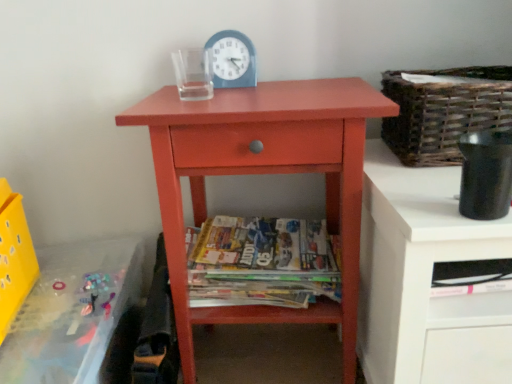
Question: In terms of width, does translucent plastic changing table at lower left look wider or thinner when compared to blue plastic clock at upper center?

Choices:
 (A) wide
 (B) thin

Answer: (A)

Question: In terms of size, does translucent plastic changing table at lower left appear bigger or smaller than blue plastic clock at upper center?

Choices:
 (A) small
 (B) big

Answer: (B)

Question: Which of these objects is positioned farthest from the matte wood nightstand at center?

Choices:
 (A) yellow plastic crate at lower left
 (B) printed paper magazines at center
 (C) woven brown basket at upper right
 (D) translucent plastic changing table at lower left
 (E) blue plastic clock at upper center

Answer: (A)

Question: Which is farther from the woven brown basket at upper right?

Choices:
 (A) blue plastic clock at upper center
 (B) yellow plastic crate at lower left
 (C) translucent plastic changing table at lower left
 (D) matte wood nightstand at center
 (E) printed paper magazines at center

Answer: (B)